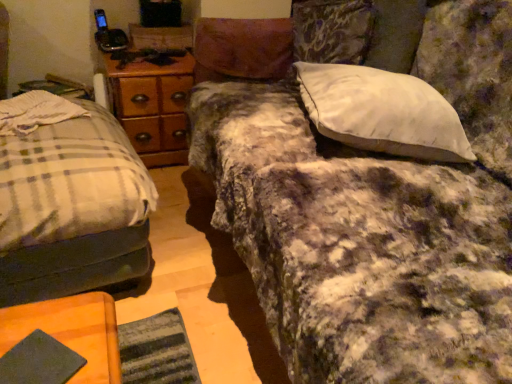
What is the approximate height of dark green fabric at lower left?

dark green fabric at lower left is 0.83 inches tall.

Measure the distance between wooden at left and camera.

5.67 feet.

Identify the location of fluffy purple blanket at center. (375, 220).

Between fluffy purple blanket at center and dark green fabric at lower left, which one has less height?

Standing shorter between the two is dark green fabric at lower left.

Consider the image. Is fluffy purple blanket at center positioned with its back to dark green fabric at lower left?

fluffy purple blanket at center is not turned away from dark green fabric at lower left.

Is fluffy purple blanket at center to the left of dark green fabric at lower left from the viewer's perspective?

Incorrect, fluffy purple blanket at center is not on the left side of dark green fabric at lower left.

Does point (406, 336) come behind point (76, 367)?

Yes.

Are white soft pillow at upper right and wooden at left far apart?

That's not correct — white soft pillow at upper right is a little close to wooden at left.

Is white soft pillow at upper right facing towards wooden at left?

No, white soft pillow at upper right is not oriented towards wooden at left.

Locate an element on the screen. The height and width of the screenshot is (384, 512). nightstand above the white soft pillow at upper right (from the image's perspective) is located at coordinates (151, 106).

From the image's perspective, which one is positioned lower, white soft pillow at upper right or wooden at left?

white soft pillow at upper right.

Considering the positions of objects white soft pillow at upper right and dark green fabric at lower left in the image provided, who is behind, white soft pillow at upper right or dark green fabric at lower left?

white soft pillow at upper right is more distant.

From the image's perspective, is white soft pillow at upper right under dark green fabric at lower left?

No, from the image's perspective, white soft pillow at upper right is not beneath dark green fabric at lower left.

Measure the distance from white soft pillow at upper right to dark green fabric at lower left.

white soft pillow at upper right is 86.51 centimeters from dark green fabric at lower left.

Can you confirm if white soft pillow at upper right is shorter than dark green fabric at lower left?

No, white soft pillow at upper right is not shorter than dark green fabric at lower left.

Can you tell me how much wooden at left and white soft pillow at upper right differ in facing direction?

106 degrees separate the facing orientations of wooden at left and white soft pillow at upper right.

Would you consider wooden at left to be distant from white soft pillow at upper right?

No, there isn't a large distance between wooden at left and white soft pillow at upper right.

Considering the relative sizes of wooden at left and white soft pillow at upper right in the image provided, is wooden at left smaller than white soft pillow at upper right?

No, wooden at left is not smaller than white soft pillow at upper right.

Considering the sizes of objects wooden at left and white soft pillow at upper right in the image provided, who is shorter, wooden at left or white soft pillow at upper right?

white soft pillow at upper right.

Can you confirm if wooden at left is bigger than plaid fabric bed at left?

Actually, wooden at left might be smaller than plaid fabric bed at left.

What's the angular difference between wooden at left and plaid fabric bed at left's facing directions?

82.5 degrees separate the facing orientations of wooden at left and plaid fabric bed at left.

The height and width of the screenshot is (384, 512). Find the location of `bed lying in front of the wooden at left`. bed lying in front of the wooden at left is located at coordinates (72, 208).

Is wooden at left aimed at plaid fabric bed at left?

No, wooden at left is not facing towards plaid fabric bed at left.

Considering the relative sizes of wooden at left and dark green fabric at lower left in the image provided, is wooden at left wider than dark green fabric at lower left?

Yes, wooden at left is wider than dark green fabric at lower left.

Is wooden at left positioned beyond the bounds of dark green fabric at lower left?

Indeed, wooden at left is completely outside dark green fabric at lower left.

Between wooden at left and dark green fabric at lower left, which one is positioned behind?

wooden at left is further away from the camera.

In terms of size, does wooden at left appear bigger or smaller than dark green fabric at lower left?

In the image, wooden at left appears to be larger than dark green fabric at lower left.

Looking at this image, is fluffy purple blanket at center directly adjacent to white soft pillow at upper right?

fluffy purple blanket at center is not next to white soft pillow at upper right, and they're not touching.

Does fluffy purple blanket at center have a larger size compared to white soft pillow at upper right?

Correct, fluffy purple blanket at center is larger in size than white soft pillow at upper right.

Visually, is fluffy purple blanket at center positioned to the left or to the right of white soft pillow at upper right?

Clearly, fluffy purple blanket at center is on the right of white soft pillow at upper right in the image.

Identify the location of pillow that appears above the fluffy purple blanket at center (from the image's perspective). (382, 112).

Find the location of a particular element. The height and width of the screenshot is (384, 512). studio couch located above the dark green fabric at lower left (from the image's perspective) is located at coordinates (375, 220).

The image size is (512, 384). I want to click on pillow located in front of the wooden at left, so click(x=382, y=112).

Which object lies nearer to the anchor point wooden at left, fluffy purple blanket at center or white soft pillow at upper right?

The object closer to wooden at left is fluffy purple blanket at center.

From the image, which object appears to be farther from wooden at left, fluffy purple blanket at center or dark green fabric at lower left?

Among the two, dark green fabric at lower left is located further to wooden at left.

Based on the photo, estimate the real-world distances between objects in this image. Which object is closer to fluffy purple blanket at center, dark green fabric at lower left or plaid fabric bed at left?

Based on the image, plaid fabric bed at left appears to be nearer to fluffy purple blanket at center.

Considering their positions, is dark green fabric at lower left positioned further to wooden at left than white soft pillow at upper right?

dark green fabric at lower left is positioned further to the anchor wooden at left.

Estimate the real-world distances between objects in this image. Which object is further from plaid fabric bed at left, wooden at left or fluffy purple blanket at center?

The object further to plaid fabric bed at left is wooden at left.

Considering their positions, is plaid fabric bed at left positioned closer to fluffy purple blanket at center than dark green fabric at lower left?

The object closer to fluffy purple blanket at center is plaid fabric bed at left.

From the image, which object appears to be nearer to dark green fabric at lower left, white soft pillow at upper right or wooden at left?

The object closer to dark green fabric at lower left is white soft pillow at upper right.

From the picture: Which object lies further to the anchor point dark green fabric at lower left, wooden at left or fluffy purple blanket at center?

The object further to dark green fabric at lower left is wooden at left.

Where is `bed positioned between dark green fabric at lower left and wooden at left from near to far`? Image resolution: width=512 pixels, height=384 pixels. bed positioned between dark green fabric at lower left and wooden at left from near to far is located at coordinates (72, 208).

Locate an element on the screen. The height and width of the screenshot is (384, 512). bed between fluffy purple blanket at center and wooden at left from front to back is located at coordinates (72, 208).

Locate an element on the screen. pillow between dark green fabric at lower left and fluffy purple blanket at center is located at coordinates (382, 112).

This screenshot has width=512, height=384. Identify the location of pillow located between dark green fabric at lower left and wooden at left in the depth direction. (382, 112).